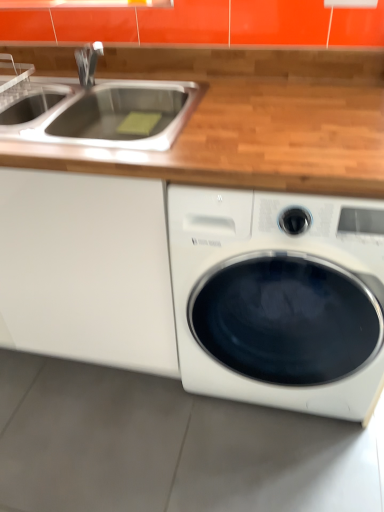
Question: From a real-world perspective, is stainless steel sink at upper left on white glossy washing machine at lower right?

Choices:
 (A) yes
 (B) no

Answer: (A)

Question: Considering the relative positions of stainless steel sink at upper left and white glossy washing machine at lower right in the image provided, is stainless steel sink at upper left to the left of white glossy washing machine at lower right from the viewer's perspective?

Choices:
 (A) yes
 (B) no

Answer: (A)

Question: From a real-world perspective, is stainless steel sink at upper left physically below white glossy washing machine at lower right?

Choices:
 (A) yes
 (B) no

Answer: (B)

Question: Would you say stainless steel sink at upper left is a long distance from white glossy washing machine at lower right?

Choices:
 (A) yes
 (B) no

Answer: (B)

Question: Is the surface of stainless steel sink at upper left in direct contact with white glossy washing machine at lower right?

Choices:
 (A) no
 (B) yes

Answer: (A)

Question: Considering their positions, is white matte cabinet at left located in front of or behind white glossy washing machine at lower right?

Choices:
 (A) behind
 (B) front

Answer: (A)

Question: Looking at their shapes, would you say white matte cabinet at left is wider or thinner than white glossy washing machine at lower right?

Choices:
 (A) wide
 (B) thin

Answer: (B)

Question: Is white matte cabinet at left bigger or smaller than white glossy washing machine at lower right?

Choices:
 (A) small
 (B) big

Answer: (B)

Question: In terms of height, does white matte cabinet at left look taller or shorter compared to white glossy washing machine at lower right?

Choices:
 (A) short
 (B) tall

Answer: (B)

Question: In terms of width, does white glossy washing machine at lower right look wider or thinner when compared to stainless steel sink at upper left?

Choices:
 (A) wide
 (B) thin

Answer: (A)

Question: Considering the relative positions of white glossy washing machine at lower right and stainless steel sink at upper left in the image provided, is white glossy washing machine at lower right to the left or to the right of stainless steel sink at upper left?

Choices:
 (A) right
 (B) left

Answer: (A)

Question: Considering the positions of point [188, 306] and point [94, 62], is point [188, 306] closer or farther from the camera than point [94, 62]?

Choices:
 (A) farther
 (B) closer

Answer: (B)

Question: Which is correct: white glossy washing machine at lower right is inside stainless steel sink at upper left, or outside of it?

Choices:
 (A) outside
 (B) inside

Answer: (A)

Question: Is white glossy washing machine at lower right inside the boundaries of white matte cabinet at left, or outside?

Choices:
 (A) inside
 (B) outside

Answer: (B)

Question: From the image's perspective, is white glossy washing machine at lower right above or below white matte cabinet at left?

Choices:
 (A) below
 (B) above

Answer: (A)